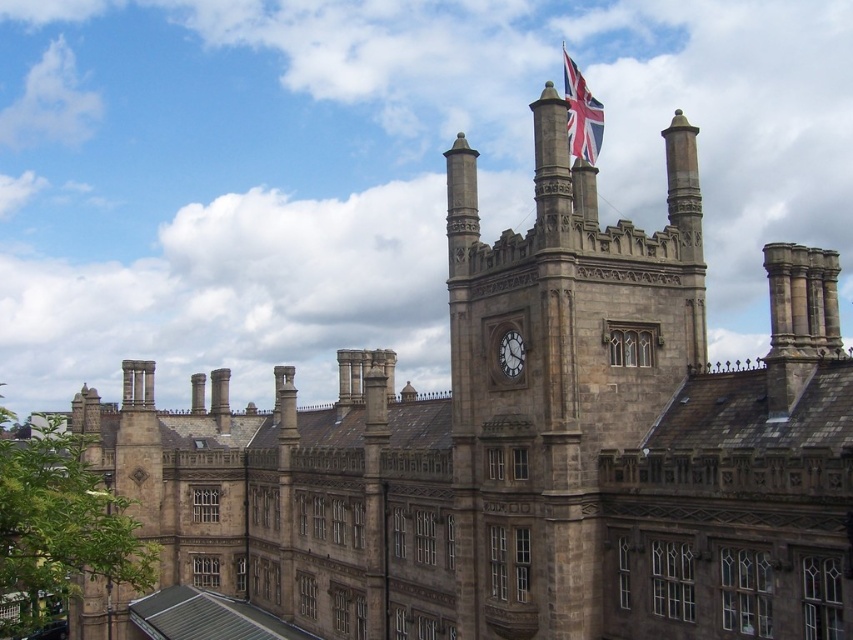
Between stone clock tower at center and union jack fabric at top center, which one is positioned lower?

Positioned lower is stone clock tower at center.

From the picture: Does stone clock tower at center appear under union jack fabric at top center?

Yes, stone clock tower at center is below union jack fabric at top center.

Which is in front, point (553, 637) or point (589, 100)?

Point (553, 637)

This screenshot has width=853, height=640. I want to click on stone clock tower at center, so click(x=558, y=374).

Between point (468, 154) and point (500, 349), which one is positioned in front?

Point (500, 349) is in front.

The height and width of the screenshot is (640, 853). I want to click on stone clock tower at center, so click(x=558, y=374).

Who is more forward, (535,177) or (500,352)?

Positioned in front is point (535,177).

Image resolution: width=853 pixels, height=640 pixels. I want to click on stone clock tower at center, so click(x=558, y=374).

Between union jack fabric at top center and polished stone clock at center, which one appears on the left side from the viewer's perspective?

polished stone clock at center is more to the left.

This screenshot has width=853, height=640. I want to click on union jack fabric at top center, so click(x=581, y=113).

Is point (593, 147) positioned in front of point (502, 360)?

That is False.

Where is `union jack fabric at top center`? union jack fabric at top center is located at coordinates (581, 113).